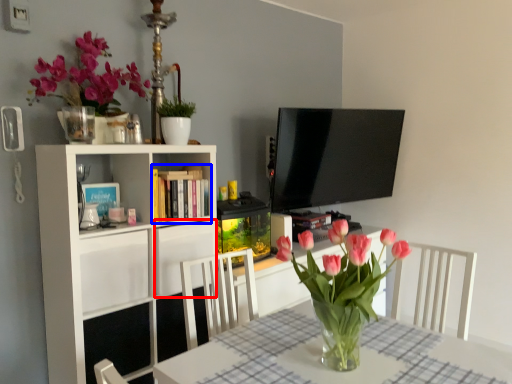
Question: Which of the following is the closest to the observer, cabinet (highlighted by a red box) or book (highlighted by a blue box)?

Choices:
 (A) cabinet
 (B) book

Answer: (A)